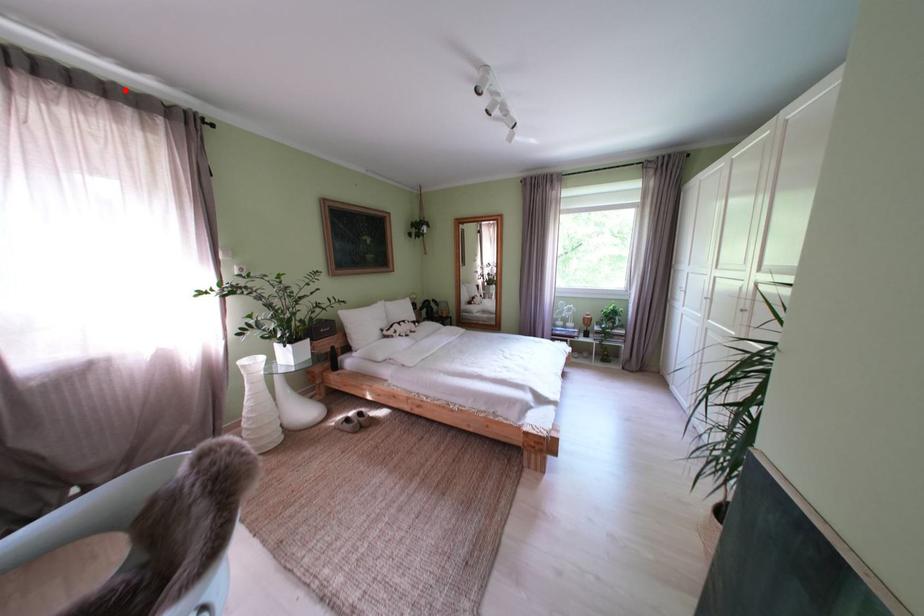
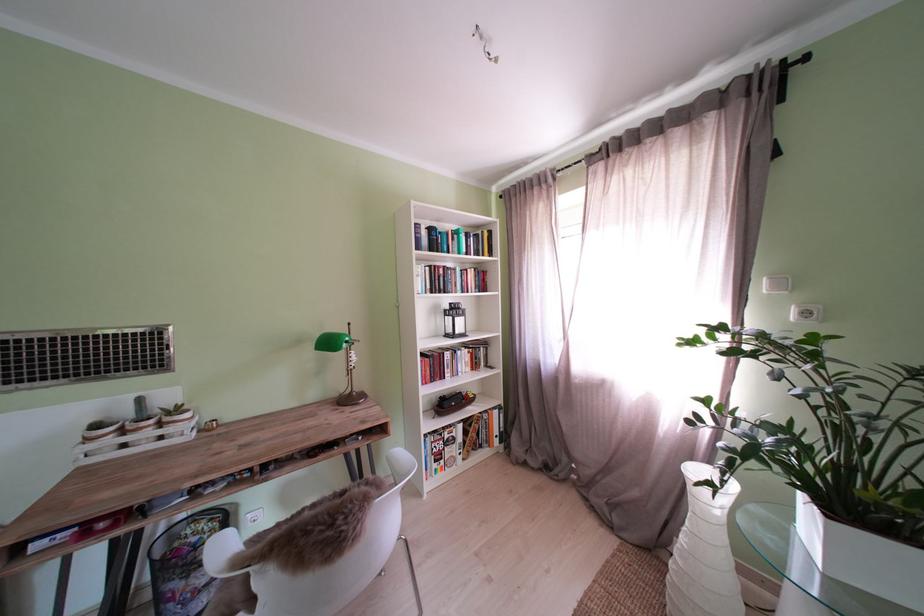
Find the pixel in the second image that matches the highlighted location in the first image.

(681, 116)